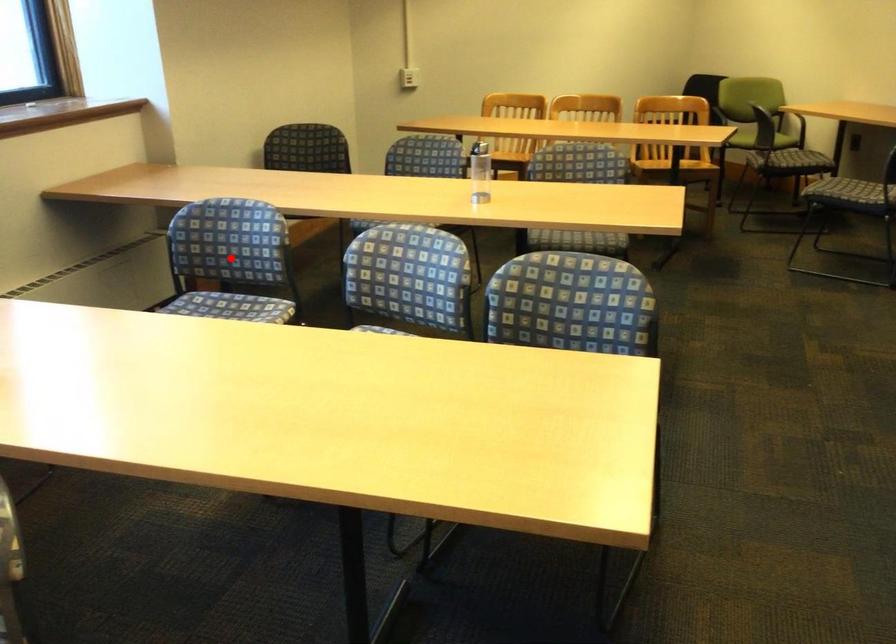
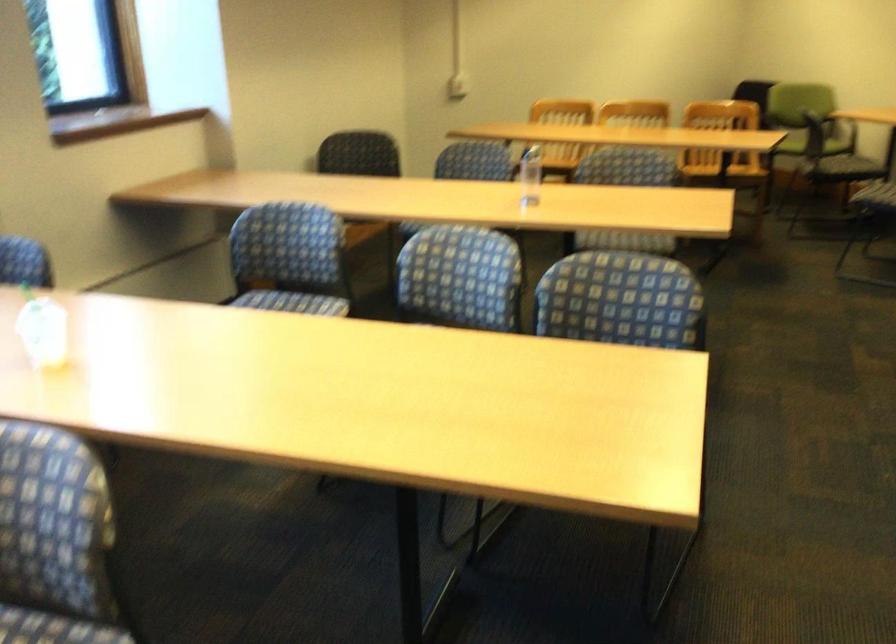
Find the pixel in the second image that matches the highlighted location in the first image.

(289, 259)